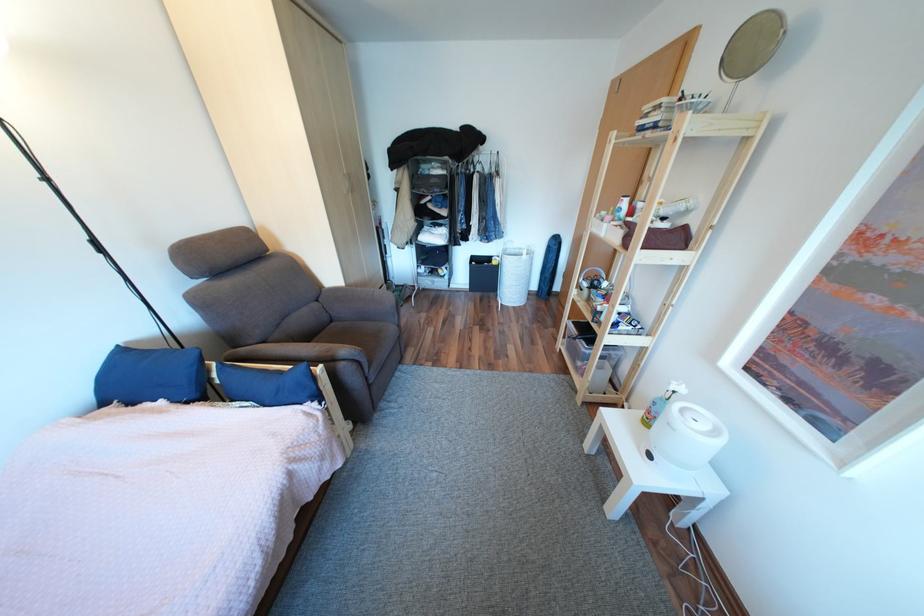
Where would you wear the white headphones? Please return your answer as a coordinate pair (x, y).

(593, 281)